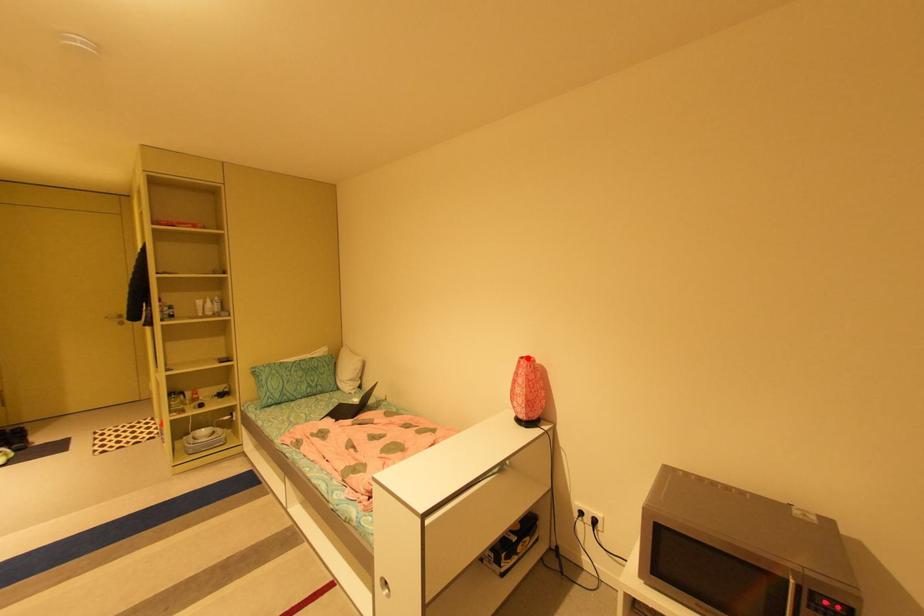
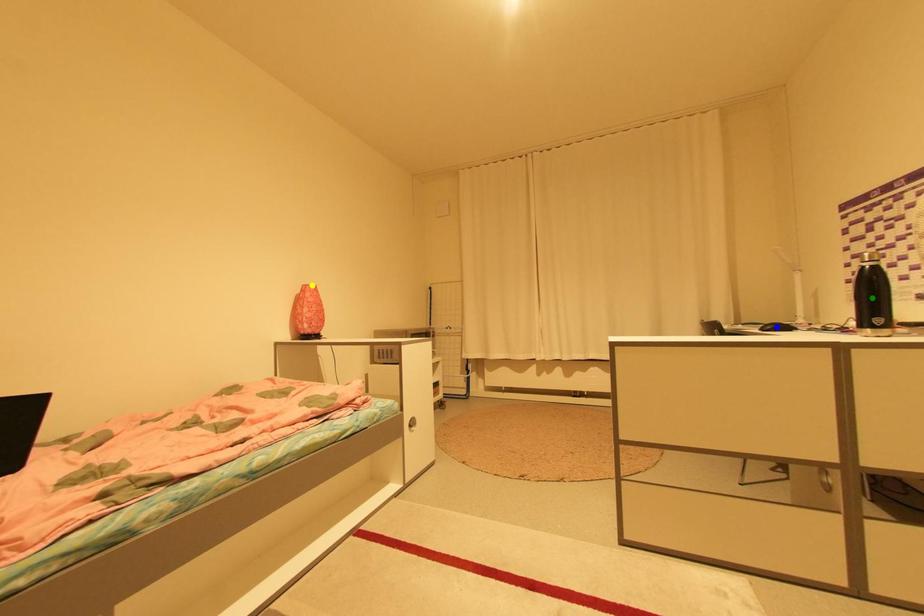
Question: I am providing you with two images of the same scene from different viewpoints. A red point is marked on the first image. You are given multiple points on the second image. In image 2, which mark is for the same physical point as the one in image 1?

Choices:
 (A) blue point
 (B) green point
 (C) yellow point

Answer: (C)